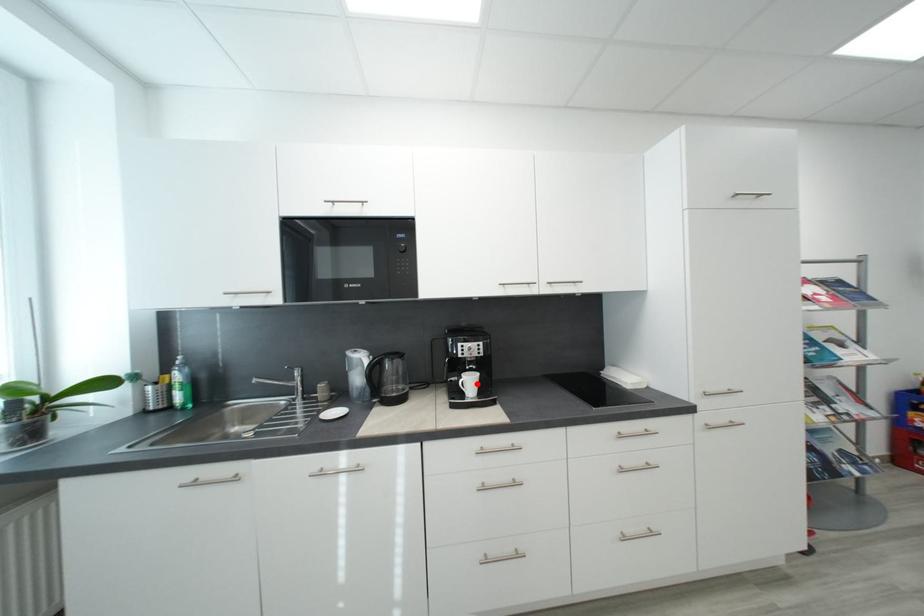
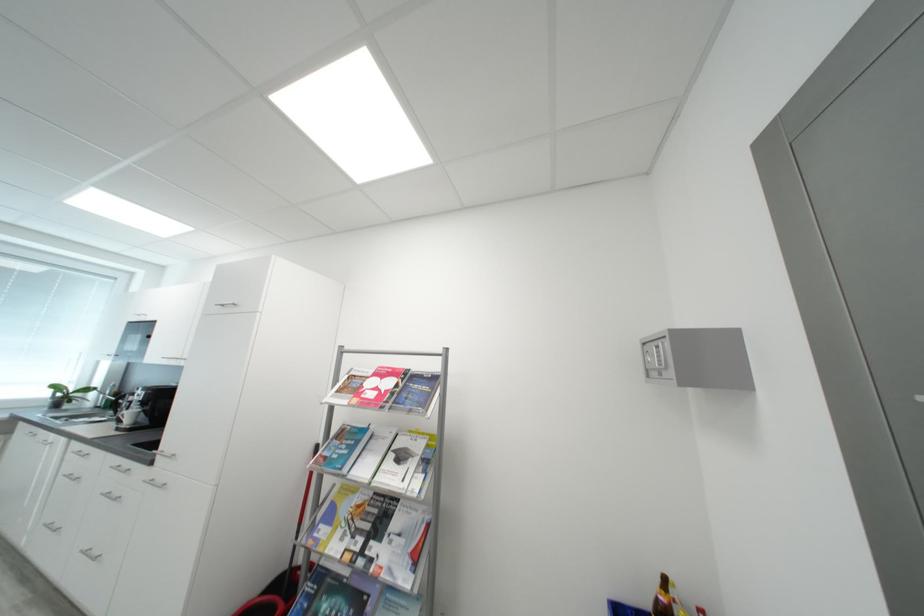
The point at the highlighted location is marked in the first image. Where is the corresponding point in the second image?

(138, 416)